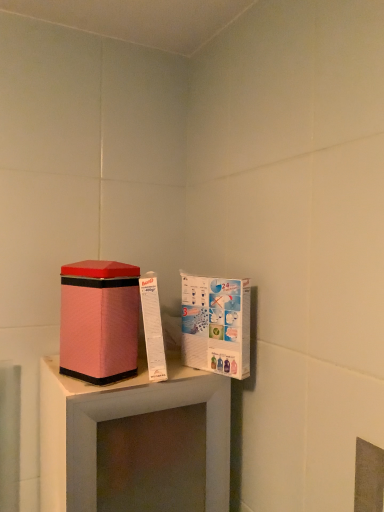
This screenshot has width=384, height=512. I want to click on pink fabric/textured box at left, so click(x=99, y=320).

The height and width of the screenshot is (512, 384). Describe the element at coordinates (99, 320) in the screenshot. I see `pink fabric/textured box at left` at that location.

What is the approximate height of pink fabric/textured box at left?

pink fabric/textured box at left is 7.86 inches in height.

This screenshot has width=384, height=512. What are the coordinates of `white cardboard box at upper right` in the screenshot? It's located at (216, 324).

The width and height of the screenshot is (384, 512). Describe the element at coordinates (216, 324) in the screenshot. I see `white cardboard box at upper right` at that location.

This screenshot has width=384, height=512. Find the location of `pink fabric/textured box at left`. pink fabric/textured box at left is located at coordinates (x=99, y=320).

Can you confirm if white cardboard box at upper right is positioned to the right of pink fabric/textured box at left?

Indeed, white cardboard box at upper right is positioned on the right side of pink fabric/textured box at left.

Is the position of white cardboard box at upper right less distant than that of pink fabric/textured box at left?

No, it is not.

Is point (249, 294) positioned in front of point (64, 354)?

No, it is behind (64, 354).

Based on the photo, from the image's perspective, between white cardboard box at upper right and pink fabric/textured box at left, which one is located above?

pink fabric/textured box at left appears higher in the image.

From a real-world perspective, is white cardboard box at upper right positioned over pink fabric/textured box at left based on gravity?

Incorrect, from a real-world perspective, white cardboard box at upper right is lower than pink fabric/textured box at left.

Considering the relative sizes of white cardboard box at upper right and pink fabric/textured box at left in the image provided, is white cardboard box at upper right thinner than pink fabric/textured box at left?

Yes, white cardboard box at upper right is thinner than pink fabric/textured box at left.

Between white cardboard box at upper right and pink fabric/textured box at left, which one has less height?

pink fabric/textured box at left is shorter.

Considering the relative sizes of white cardboard box at upper right and pink fabric/textured box at left in the image provided, is white cardboard box at upper right smaller than pink fabric/textured box at left?

Yes, white cardboard box at upper right is smaller than pink fabric/textured box at left.

Is white cardboard box at upper right not inside pink fabric/textured box at left?

Yes, white cardboard box at upper right is outside of pink fabric/textured box at left.

Consider the image. Is white cardboard box at upper right not close to pink fabric/textured box at left?

No, white cardboard box at upper right is not far away from pink fabric/textured box at left.

Is white cardboard box at upper right oriented away from pink fabric/textured box at left?

No, white cardboard box at upper right is not facing the opposite direction of pink fabric/textured box at left.

How many degrees apart are the facing directions of white cardboard box at upper right and pink fabric/textured box at left?

The angle between the facing direction of white cardboard box at upper right and the facing direction of pink fabric/textured box at left is 62.4 degrees.

You are a GUI agent. You are given a task and a screenshot of the screen. Output one action in this format:
    pyautogui.click(x=<x>, y=<y>)
    Task: Click on the cardboard box on the right of pink fabric/textured box at left
    The image size is (384, 512).
    Given the screenshot: What is the action you would take?
    pyautogui.click(x=216, y=324)

Which object is positioned more to the right, pink fabric/textured box at left or white cardboard box at upper right?

white cardboard box at upper right is more to the right.

Is pink fabric/textured box at left behind white cardboard box at upper right?

No, it is in front of white cardboard box at upper right.

Which is closer to the camera, (94, 298) or (243, 346)?

Point (94, 298) is positioned closer to the camera compared to point (243, 346).

Consider the image. From the image's perspective, which one is positioned lower, pink fabric/textured box at left or white cardboard box at upper right?

From the image's view, white cardboard box at upper right is below.

From a real-world perspective, is pink fabric/textured box at left positioned under white cardboard box at upper right based on gravity?

No.

Considering the relative sizes of pink fabric/textured box at left and white cardboard box at upper right in the image provided, is pink fabric/textured box at left wider than white cardboard box at upper right?

Yes.

Considering the sizes of objects pink fabric/textured box at left and white cardboard box at upper right in the image provided, who is shorter, pink fabric/textured box at left or white cardboard box at upper right?

Standing shorter between the two is pink fabric/textured box at left.

In terms of size, does pink fabric/textured box at left appear bigger or smaller than white cardboard box at upper right?

In the image, pink fabric/textured box at left appears to be larger than white cardboard box at upper right.

Is pink fabric/textured box at left inside or outside of white cardboard box at upper right?

The correct answer is: outside.

Is pink fabric/textured box at left positioned far away from white cardboard box at upper right?

pink fabric/textured box at left is actually quite close to white cardboard box at upper right.

Is pink fabric/textured box at left turned away from white cardboard box at upper right?

pink fabric/textured box at left is not turned away from white cardboard box at upper right.

Locate an element on the screen. box located in front of the white cardboard box at upper right is located at coordinates (99, 320).

Image resolution: width=384 pixels, height=512 pixels. What are the coordinates of `cardboard box below the pink fabric/textured box at left (from a real-world perspective)` in the screenshot? It's located at pyautogui.click(x=216, y=324).

Locate an element on the screen. cardboard box behind the pink fabric/textured box at left is located at coordinates (216, 324).